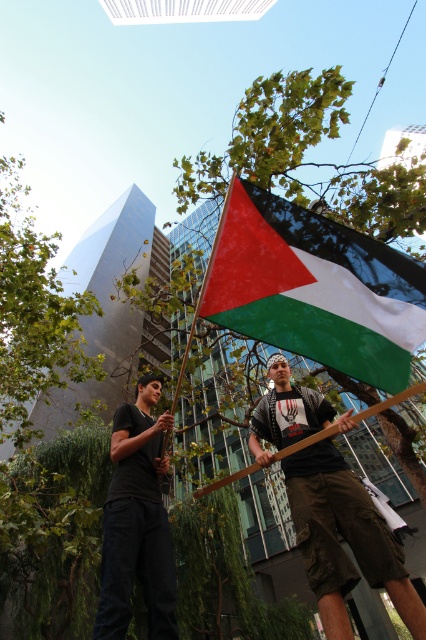
You are a photographer aiming to capture a clear shot of the polyester flag at center. The black matte shirt at center is blocking part of the flag. Can you estimate whether the flag is wider than the shirt to determine if moving the shirt slightly to the right would fully reveal the flag?

The polyester flag at center might be wider than black matte shirt at center, so moving the black matte shirt at center to the right could potentially reveal more of the polyester flag at center if the flag is indeed wider. However, since the flag might be wider, adjusting the shirt position may help but there is uncertainty without exact measurements.

You are a photographer trying to capture the polyester flag at center and the black matte shirt at center in a single shot. Which object should you adjust your camera focus to first if you want to ensure both are in focus, considering their positions?

The black matte shirt at center is on the left side of the polyester flag at center, so you should focus on the black matte shirt at center first to ensure both are in focus since it is closer to the camera.